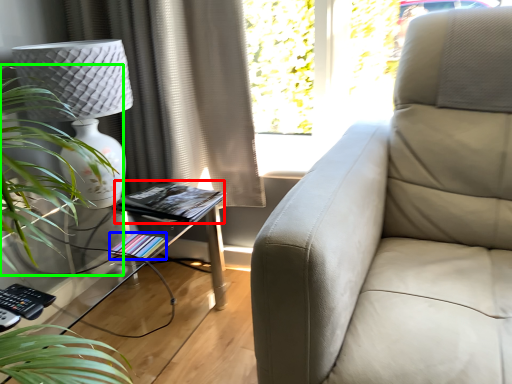
Question: Which object is the closest to the book (highlighted by a red box)? Choose among these: book (highlighted by a blue box) or houseplant (highlighted by a green box).

Choices:
 (A) book
 (B) houseplant

Answer: (A)